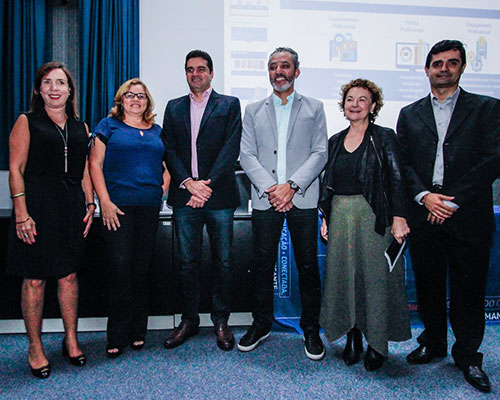
At what (x,y) coordinates should I click in order to perform the action: click on wall. Please return your answer as a coordinate pair (x, y). Looking at the image, I should click on (183, 22).